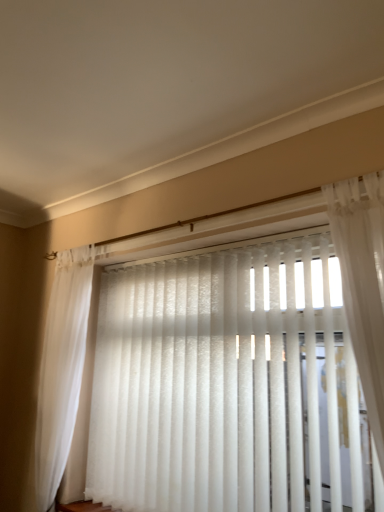
At what (x,y) coordinates should I click in order to perform the action: click on white sheer curtain at left. Please return your answer as a coordinate pair (x, y). Looking at the image, I should click on (62, 368).

Image resolution: width=384 pixels, height=512 pixels. Describe the element at coordinates (62, 368) in the screenshot. I see `white sheer curtain at left` at that location.

At what (x,y) coordinates should I click in order to perform the action: click on white sheer curtain at left. Please return your answer as a coordinate pair (x, y). This screenshot has width=384, height=512. Looking at the image, I should click on (62, 368).